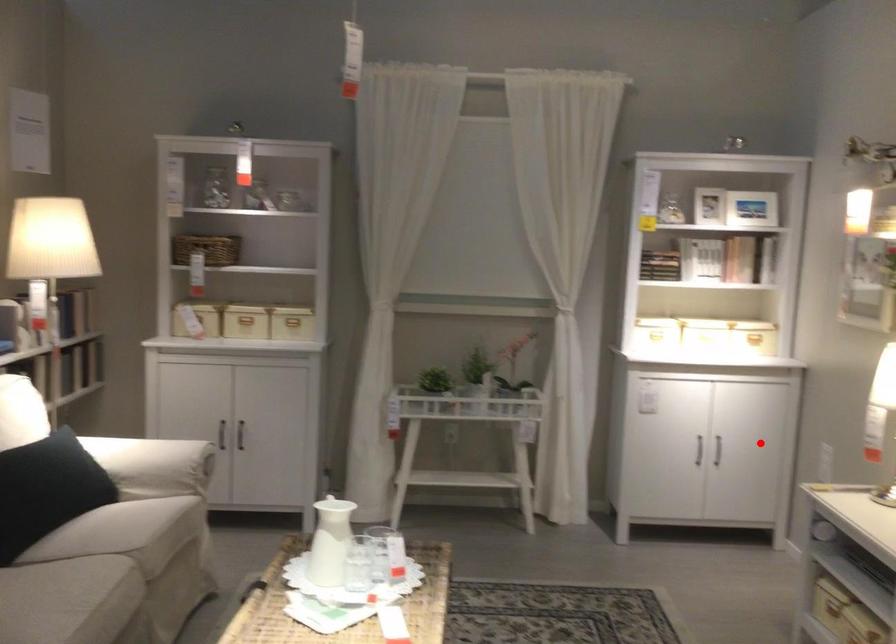
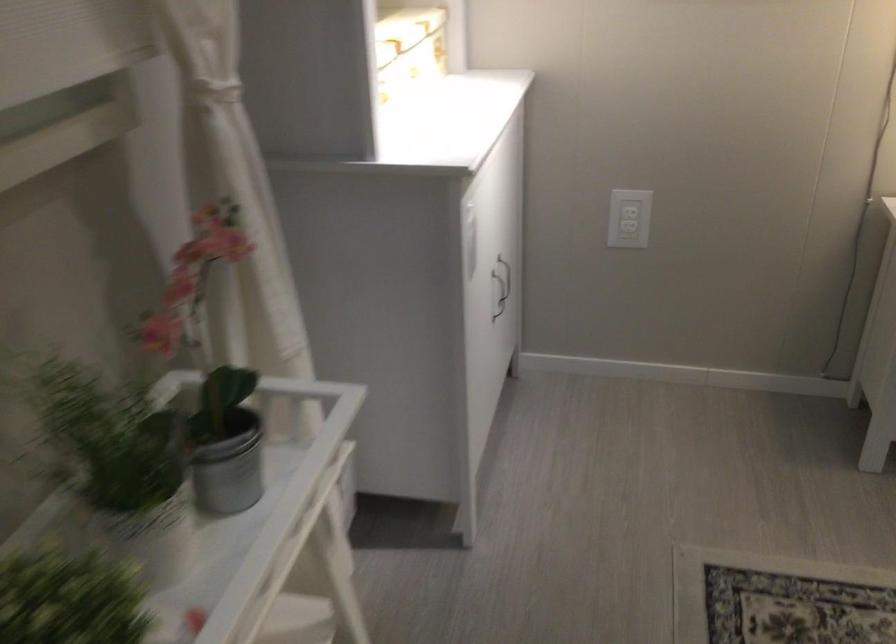
The point at the highlighted location is marked in the first image. Where is the corresponding point in the second image?

(505, 277)